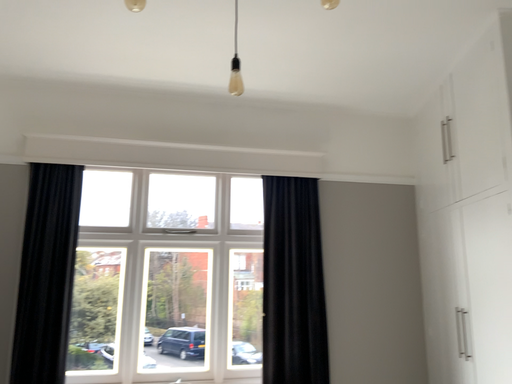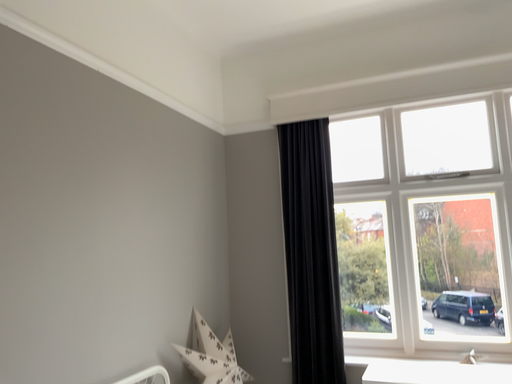
Question: Which way did the camera rotate in the video?

Choices:
 (A) rotated right
 (B) rotated left

Answer: (B)